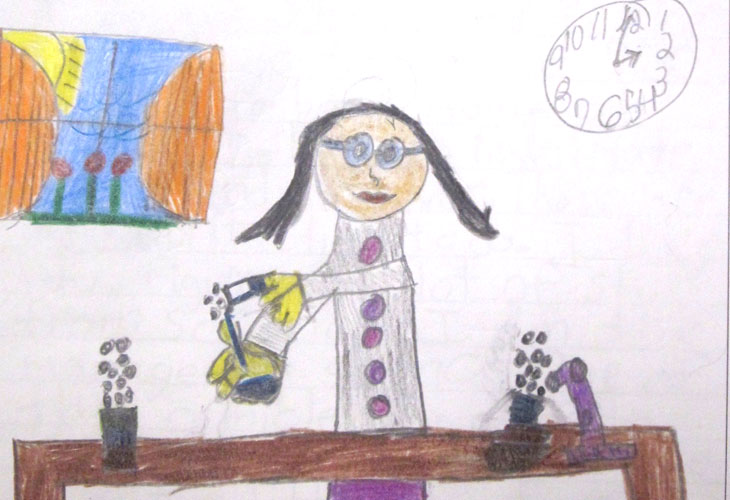
At what (x,y) coordinates should I click in order to perform the action: click on "12" in clock. Please return your answer as a coordinate pair (x, y). Looking at the image, I should click on (626, 23).